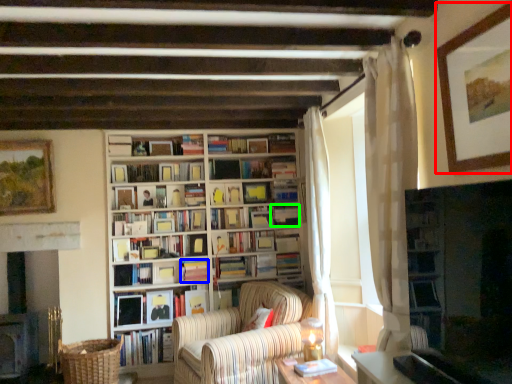
Question: Which is nearer to the picture frame (highlighted by a red box)? book (highlighted by a blue box) or book (highlighted by a green box).

Choices:
 (A) book
 (B) book

Answer: (B)